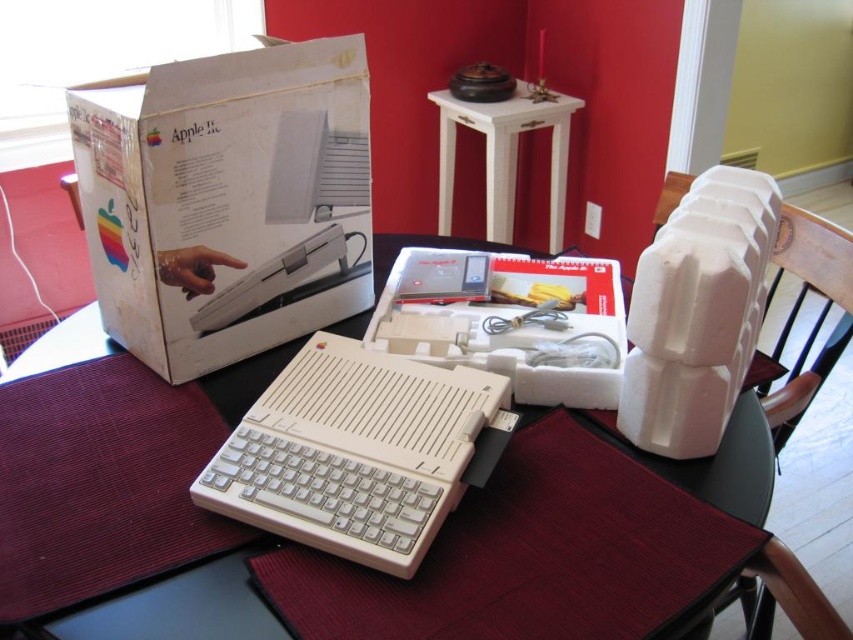
Looking at this image, between white cardboard box at upper left and white foam chair at right, which one is positioned higher?

white cardboard box at upper left

The height and width of the screenshot is (640, 853). What do you see at coordinates (227, 200) in the screenshot? I see `white cardboard box at upper left` at bounding box center [227, 200].

Locate an element on the screen. The image size is (853, 640). white cardboard box at upper left is located at coordinates (227, 200).

Does point (415, 525) lie behind point (480, 106)?

No, it is not.

Is point (428, 476) farther from viewer compared to point (442, 172)?

No, it is in front of (442, 172).

Where is `white plastic computer at center`? white plastic computer at center is located at coordinates (357, 451).

From the picture: Does white plastic table at center appear on the right side of white foam chair at right?

Incorrect, white plastic table at center is not on the right side of white foam chair at right.

Can you confirm if white plastic table at center is thinner than white foam chair at right?

Incorrect, white plastic table at center's width is not less than white foam chair at right's.

The image size is (853, 640). Describe the element at coordinates (728, 467) in the screenshot. I see `white plastic table at center` at that location.

Identify the location of white plastic table at center. (728, 467).